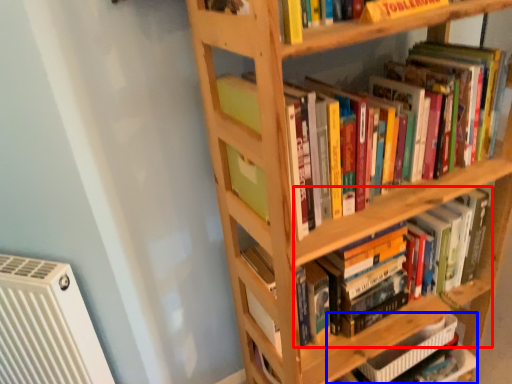
Question: Which object is further to the camera taking this photo, book (highlighted by a red box) or book (highlighted by a blue box)?

Choices:
 (A) book
 (B) book

Answer: (B)